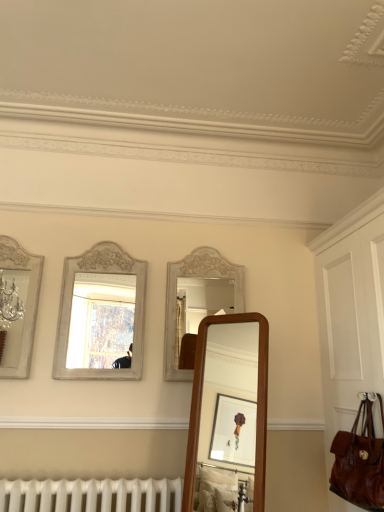
Locate an element on the screen. Image resolution: width=384 pixels, height=512 pixels. brown leather bag at right is located at coordinates (350, 313).

At what (x,y) coordinates should I click in order to perform the action: click on brown leather handbag at lower right. Please return your answer as a coordinate pair (x, y). Looking at the image, I should click on (359, 462).

The width and height of the screenshot is (384, 512). Describe the element at coordinates (197, 301) in the screenshot. I see `white painted wood mirror at center, marked as the first mirror in a right-to-left arrangement` at that location.

I want to click on silver metallic mirror at left, arranged as the 1th mirror when viewed from the left, so click(24, 306).

Which of these two, brown leather bag at right or silver metallic mirror at left, arranged as the 1th mirror when viewed from the left, stands taller?

Standing taller between the two is brown leather bag at right.

Based on their sizes in the image, would you say brown leather bag at right is bigger or smaller than silver metallic mirror at left, placed as the 2th mirror when sorted from right to left?

brown leather bag at right is bigger than silver metallic mirror at left, placed as the 2th mirror when sorted from right to left.

Considering the positions of point (376, 234) and point (1, 244), is point (376, 234) closer or farther from the camera than point (1, 244)?

Point (376, 234) is positioned closer to the camera compared to point (1, 244).

From the image's perspective, which one is positioned higher, brown leather bag at right or silver metallic mirror at left, placed as the 2th mirror when sorted from right to left?

silver metallic mirror at left, placed as the 2th mirror when sorted from right to left.

Are silver metallic mirror at left, arranged as the 1th mirror when viewed from the left, and brown leather bag at right beside each other?

silver metallic mirror at left, arranged as the 1th mirror when viewed from the left, and brown leather bag at right are clearly separated.

Does silver metallic mirror at left, arranged as the 1th mirror when viewed from the left, have a greater width compared to brown leather bag at right?

In fact, silver metallic mirror at left, arranged as the 1th mirror when viewed from the left, might be narrower than brown leather bag at right.

Is silver metallic mirror at left, arranged as the 1th mirror when viewed from the left, bigger or smaller than brown leather bag at right?

Clearly, silver metallic mirror at left, arranged as the 1th mirror when viewed from the left, is smaller in size than brown leather bag at right.

Is the surface of silver metallic mirror at left, placed as the 2th mirror when sorted from right to left, in direct contact with brown leather handbag at lower right?

No, silver metallic mirror at left, placed as the 2th mirror when sorted from right to left, is not next to brown leather handbag at lower right.

Considering the points (21, 321) and (362, 406), which point is behind, point (21, 321) or point (362, 406)?

Point (21, 321)

Can you confirm if silver metallic mirror at left, placed as the 2th mirror when sorted from right to left, is taller than brown leather handbag at lower right?

Yes, silver metallic mirror at left, placed as the 2th mirror when sorted from right to left, is taller than brown leather handbag at lower right.

Is silver metallic mirror at left, placed as the 2th mirror when sorted from right to left, turned away from brown leather handbag at lower right?

No, silver metallic mirror at left, placed as the 2th mirror when sorted from right to left,'s orientation is not away from brown leather handbag at lower right.

Is brown leather handbag at lower right positioned before white painted wood mirror at center, marked as the first mirror in a right-to-left arrangement?

That is True.

Is point (348, 445) closer to viewer compared to point (180, 339)?

That is True.

Is brown leather handbag at lower right taller or shorter than white painted wood mirror at center, the 2th mirror viewed from the left?

In the image, brown leather handbag at lower right appears to be shorter than white painted wood mirror at center, the 2th mirror viewed from the left.

Could you tell me if brown leather handbag at lower right is turned towards brown leather bag at right?

No, brown leather handbag at lower right is not turned towards brown leather bag at right.

How different are the orientations of brown leather handbag at lower right and brown leather bag at right in degrees?

The angle between the facing direction of brown leather handbag at lower right and the facing direction of brown leather bag at right is 0.00397 degrees.

Is brown leather handbag at lower right not inside brown leather bag at right?

No.

Are brown leather handbag at lower right and brown leather bag at right making contact?

No, brown leather handbag at lower right is not in contact with brown leather bag at right.

In the image, is white painted wood mirror at center, marked as the first mirror in a right-to-left arrangement, positioned in front of or behind brown leather handbag at lower right?

Clearly, white painted wood mirror at center, marked as the first mirror in a right-to-left arrangement, is behind brown leather handbag at lower right.

Considering the sizes of objects white painted wood mirror at center, marked as the first mirror in a right-to-left arrangement, and brown leather handbag at lower right in the image provided, who is wider, white painted wood mirror at center, marked as the first mirror in a right-to-left arrangement, or brown leather handbag at lower right?

brown leather handbag at lower right.

Does white painted wood mirror at center, marked as the first mirror in a right-to-left arrangement, have a lesser height compared to brown leather handbag at lower right?

No, white painted wood mirror at center, marked as the first mirror in a right-to-left arrangement, is not shorter than brown leather handbag at lower right.

Is brown leather handbag at lower right surrounded by white painted wood mirror at center, marked as the first mirror in a right-to-left arrangement?

That's incorrect, brown leather handbag at lower right is not inside white painted wood mirror at center, marked as the first mirror in a right-to-left arrangement.

From the image's perspective, is white painted wood mirror at center, marked as the first mirror in a right-to-left arrangement, under brown leather bag at right?

Incorrect, from the image's perspective, white painted wood mirror at center, marked as the first mirror in a right-to-left arrangement, is higher than brown leather bag at right.

At what (x,y) coordinates should I click in order to perform the action: click on the 1st mirror counting from the left side of the brown leather bag at right. Please return your answer as a coordinate pair (x, y). Looking at the image, I should click on (197, 301).

Does point (186, 270) come closer to viewer compared to point (317, 293)?

Yes, point (186, 270) is in front of point (317, 293).

Which of these two, white painted wood mirror at center, the 2th mirror viewed from the left, or brown leather bag at right, stands taller?

With more height is brown leather bag at right.

Locate an element on the screen. The width and height of the screenshot is (384, 512). dresser that is below the silver metallic mirror at left, placed as the 2th mirror when sorted from right to left (from the image's perspective) is located at coordinates (350, 313).

There is a brown leather bag at right. Where is `the 2nd mirror above it (from a real-world perspective)`? the 2nd mirror above it (from a real-world perspective) is located at coordinates (24, 306).

Based on their spatial positions, is brown leather handbag at lower right or white painted wood mirror at center, the 2th mirror viewed from the left, closer to silver metallic mirror at left, placed as the 2th mirror when sorted from right to left?

white painted wood mirror at center, the 2th mirror viewed from the left.

Based on the photo, from the image, which object appears to be nearer to brown leather bag at right, brown leather handbag at lower right or silver metallic mirror at left, placed as the 2th mirror when sorted from right to left?

brown leather handbag at lower right.

Looking at the image, which one is located closer to brown leather bag at right, silver metallic mirror at left, arranged as the 1th mirror when viewed from the left, or brown leather handbag at lower right?

brown leather handbag at lower right is closer to brown leather bag at right.

Which object lies further to the anchor point brown leather handbag at lower right, white painted wood mirror at center, the 2th mirror viewed from the left, or brown leather bag at right?

white painted wood mirror at center, the 2th mirror viewed from the left, lies further to brown leather handbag at lower right than the other object.

Based on their spatial positions, is brown leather bag at right or brown leather handbag at lower right closer to white painted wood mirror at center, the 2th mirror viewed from the left?

Based on the image, brown leather bag at right appears to be nearer to white painted wood mirror at center, the 2th mirror viewed from the left.

Estimate the real-world distances between objects in this image. Which object is further from white painted wood mirror at center, the 2th mirror viewed from the left, brown leather handbag at lower right or silver metallic mirror at left, placed as the 2th mirror when sorted from right to left?

brown leather handbag at lower right.

From the image, which object appears to be nearer to brown leather handbag at lower right, white painted wood mirror at center, marked as the first mirror in a right-to-left arrangement, or silver metallic mirror at left, placed as the 2th mirror when sorted from right to left?

Among the two, white painted wood mirror at center, marked as the first mirror in a right-to-left arrangement, is located nearer to brown leather handbag at lower right.

From the image, which object appears to be nearer to brown leather handbag at lower right, silver metallic mirror at left, placed as the 2th mirror when sorted from right to left, or brown leather bag at right?

brown leather bag at right.

At what (x,y) coordinates should I click in order to perform the action: click on handbag between brown leather bag at right and white painted wood mirror at center, the 2th mirror viewed from the left, in the front-back direction. Please return your answer as a coordinate pair (x, y). This screenshot has height=512, width=384. Looking at the image, I should click on (359, 462).

Where is `mirror located between silver metallic mirror at left, arranged as the 1th mirror when viewed from the left, and brown leather bag at right in the left-right direction`? The image size is (384, 512). mirror located between silver metallic mirror at left, arranged as the 1th mirror when viewed from the left, and brown leather bag at right in the left-right direction is located at coordinates (197, 301).

The height and width of the screenshot is (512, 384). What are the coordinates of `handbag between silver metallic mirror at left, placed as the 2th mirror when sorted from right to left, and brown leather bag at right from left to right` in the screenshot? It's located at (359, 462).

You are a GUI agent. You are given a task and a screenshot of the screen. Output one action in this format:
    pyautogui.click(x=<x>, y=<y>)
    Task: Click on the mirror between silver metallic mirror at left, placed as the 2th mirror when sorted from right to left, and brown leather handbag at lower right from left to right
    Image resolution: width=384 pixels, height=512 pixels.
    Given the screenshot: What is the action you would take?
    pyautogui.click(x=197, y=301)